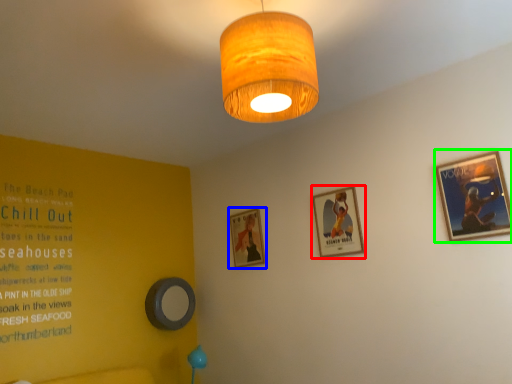
Question: Based on their relative distances, which object is nearer to picture frame (highlighted by a red box)? Choose from picture frame (highlighted by a blue box) and picture frame (highlighted by a green box).

Choices:
 (A) picture frame
 (B) picture frame

Answer: (A)